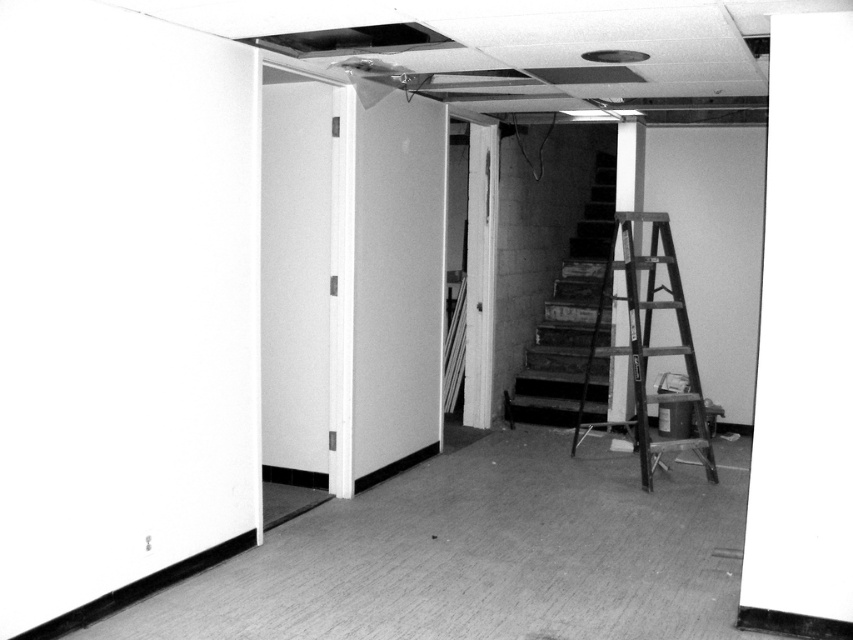
Looking at this image, is wooden at right closer to camera compared to smooth white pillar at center?

Yes.

Where is `wooden at right`? This screenshot has width=853, height=640. wooden at right is located at coordinates (648, 348).

In order to click on wooden at right in this screenshot , I will do `click(648, 348)`.

Does smooth carpet at lower center appear over wooden at right?

No.

Is point (450, 467) positioned behind point (662, 394)?

No, (450, 467) is in front of (662, 394).

This screenshot has width=853, height=640. Identify the location of smooth carpet at lower center. (480, 556).

Does point (614, 609) lie behind point (633, 120)?

No, (614, 609) is in front of (633, 120).

Can you confirm if smooth carpet at lower center is wider than smooth white pillar at center?

Indeed, smooth carpet at lower center has a greater width compared to smooth white pillar at center.

Where is `smooth carpet at lower center`? The width and height of the screenshot is (853, 640). smooth carpet at lower center is located at coordinates (480, 556).

You are a GUI agent. You are given a task and a screenshot of the screen. Output one action in this format:
    pyautogui.click(x=<x>, y=<y>)
    Task: Click on the smooth carpet at lower center
    The image size is (853, 640).
    Given the screenshot: What is the action you would take?
    pyautogui.click(x=480, y=556)